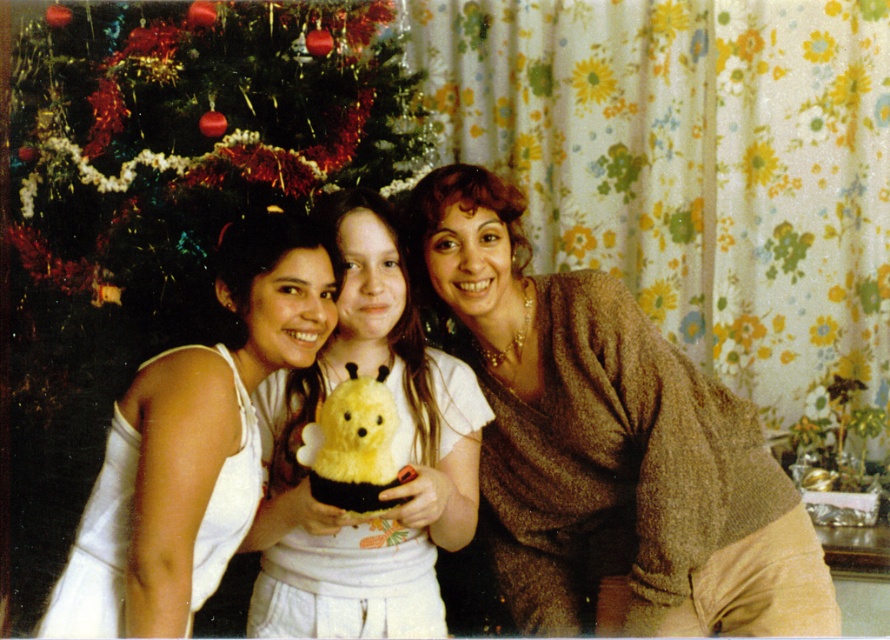
Can you confirm if brown textured sweater at center is bigger than yellow fuzzy plush bee at center?

Yes, brown textured sweater at center is bigger than yellow fuzzy plush bee at center.

The image size is (890, 640). What do you see at coordinates (605, 444) in the screenshot?
I see `brown textured sweater at center` at bounding box center [605, 444].

Where is `brown textured sweater at center`? The image size is (890, 640). brown textured sweater at center is located at coordinates (605, 444).

Based on the photo, between brown textured sweater at center and yellow plush bear at center, which one appears on the left side from the viewer's perspective?

yellow plush bear at center

Is point (556, 396) closer to camera compared to point (268, 588)?

No.

The height and width of the screenshot is (640, 890). What are the coordinates of `brown textured sweater at center` in the screenshot? It's located at (605, 444).

Is brown textured sweater at center closer to the viewer compared to white fabric at left?

No, it is behind white fabric at left.

Is brown textured sweater at center thinner than white fabric at left?

Incorrect, brown textured sweater at center's width is not less than white fabric at left's.

Locate an element on the screen. brown textured sweater at center is located at coordinates (605, 444).